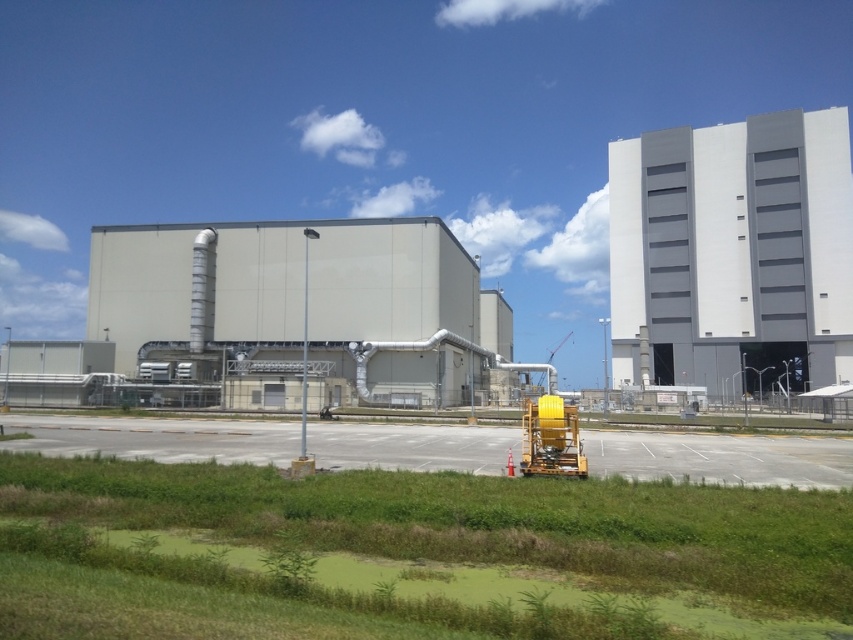
Does gray concrete factory at center have a lesser height compared to gray concrete building at upper right?

Yes, gray concrete factory at center is shorter than gray concrete building at upper right.

Who is shorter, gray concrete factory at center or gray concrete building at upper right?

gray concrete factory at center

Between point (335, 225) and point (676, 358), which one is positioned behind?

The point (676, 358) is more distant.

This screenshot has width=853, height=640. I want to click on gray concrete factory at center, so click(x=300, y=310).